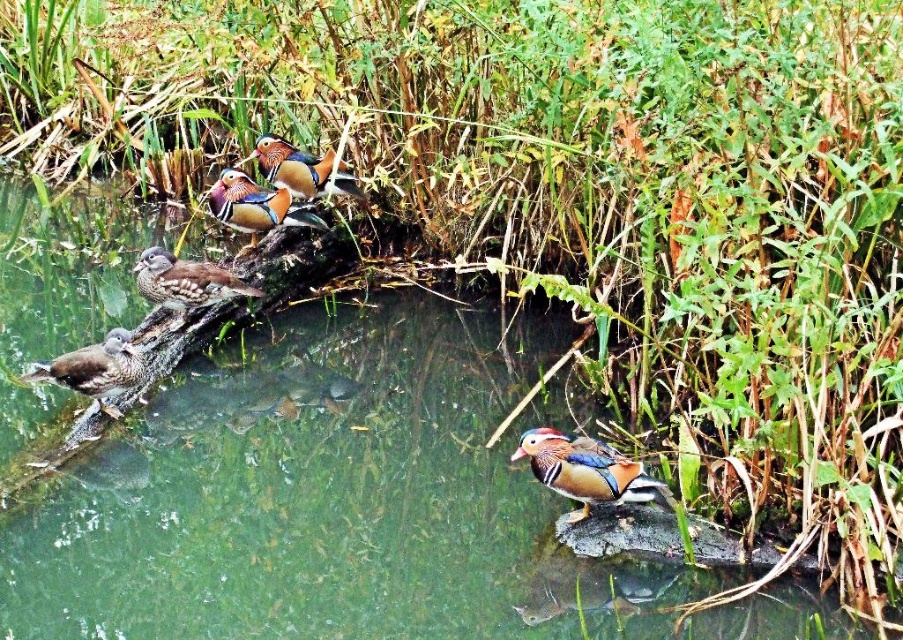
Is point (548, 432) positioned before point (173, 310)?

Yes, point (548, 432) is in front of point (173, 310).

Who is higher up, shiny multicolored duck at center or brown speckled duck at upper left?

brown speckled duck at upper left

Who is more forward, (597,500) or (196,272)?

Point (597,500) is more forward.

Where is `shiny multicolored duck at center`? This screenshot has width=903, height=640. shiny multicolored duck at center is located at coordinates (588, 472).

Does brown matte duck at lower left have a larger size compared to shiny orange duck at upper center?

Incorrect, brown matte duck at lower left is not larger than shiny orange duck at upper center.

Which is behind, point (112, 381) or point (287, 179)?

The point (287, 179) is more distant.

I want to click on brown matte duck at lower left, so click(x=94, y=369).

Is shiny multicolored duck at center below multicolored glossy duck at upper center?

Yes.

Between shiny multicolored duck at center and multicolored glossy duck at upper center, which one has less height?

shiny multicolored duck at center is shorter.

Who is more forward, (545, 460) or (287, 209)?

Point (545, 460) is more forward.

Find the location of `shiny multicolored duck at center`. shiny multicolored duck at center is located at coordinates (588, 472).